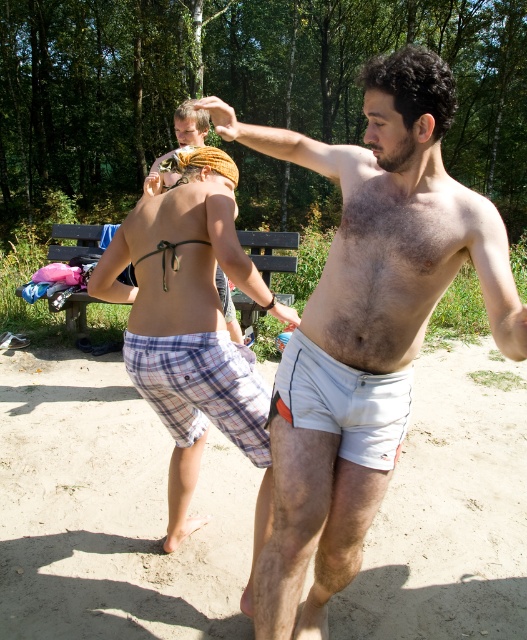
You are planning to buy a pair of shorts similar to the ones in the image. The store has two options available. The first option is the plaid fabric shorts at center, and the second is the plaid shorts at center. Which pair of shorts has a wider width according to the image?

The plaid shorts at center has a greater width compared to the plaid fabric shorts at center, so the plaid shorts at center is wider.

In the scene, there are two pairs of shorts at the center of the image. The first is labeled as plaid fabric shorts at center, and the second is plaid shorts at center. Based on their positions, which pair of shorts is shorter in height?

The plaid fabric shorts at center has a lesser height compared to plaid shorts at center, so the plaid fabric shorts at center is shorter in height.